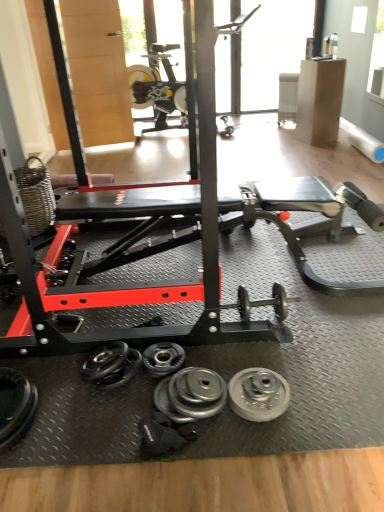
Locate an element on the screen. The image size is (384, 512). space that is in front of silver metallic weight at center, arranged as the second wheel when viewed from the left is located at coordinates (269, 448).